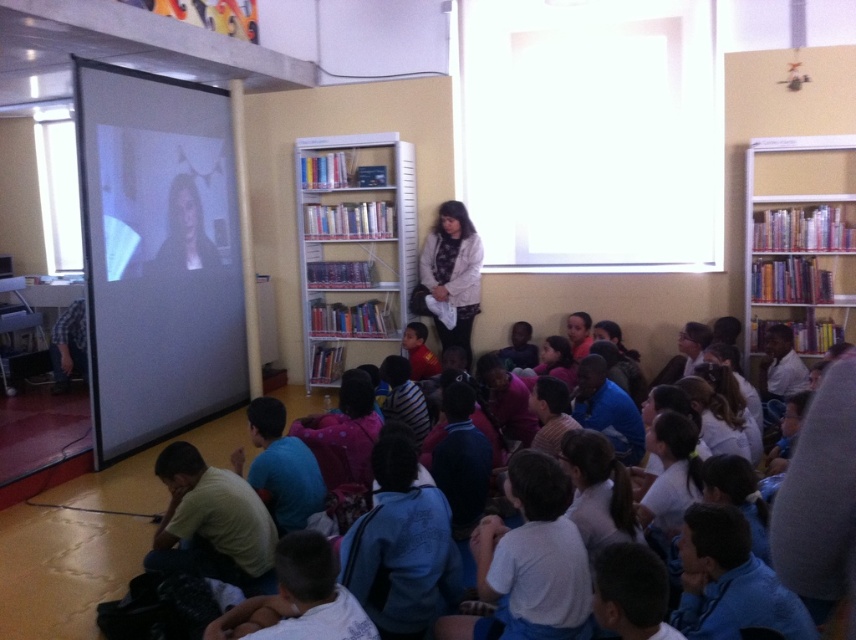
Question: Which point is closer to the camera?

Choices:
 (A) (438, 276)
 (B) (544, 632)
 (C) (403, 147)

Answer: (B)

Question: Is white metal bookcase at center thinner than white plastic bookcase at upper right?

Choices:
 (A) no
 (B) yes

Answer: (A)

Question: Which object is closer to the camera taking this photo?

Choices:
 (A) white metal bookcase at center
 (B) white fabric at center
 (C) white cotton shirt at lower center

Answer: (C)

Question: Is white metal bookcase at center further to the viewer compared to white cotton shirt at lower center?

Choices:
 (A) yes
 (B) no

Answer: (A)

Question: Which point is farther to the camera?

Choices:
 (A) (306, 321)
 (B) (788, 268)

Answer: (A)

Question: Can you confirm if white metal bookcase at center is thinner than white plastic bookcase at upper right?

Choices:
 (A) no
 (B) yes

Answer: (A)